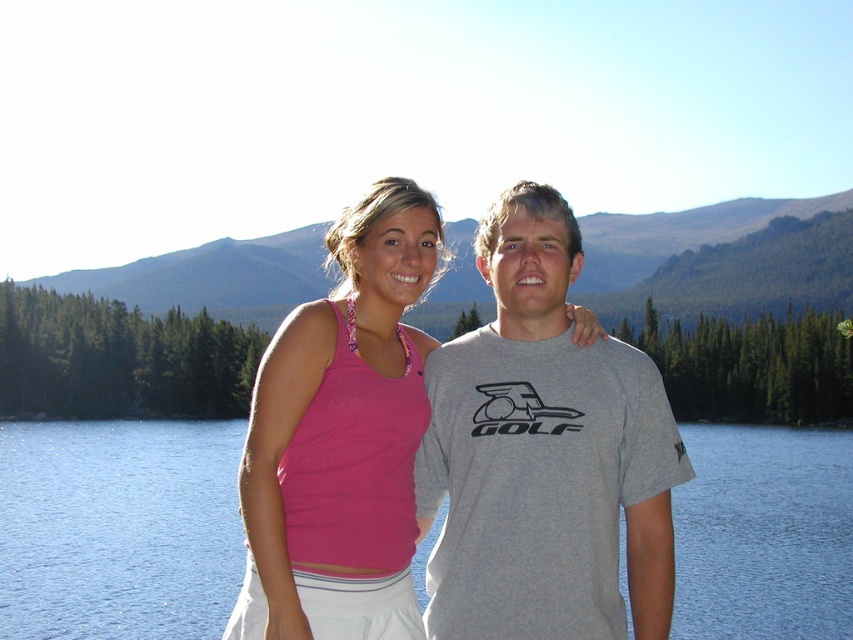
You are planning to take a photo of the blue water at center and the green forested mountain at upper center. Which object should you focus on first if you want to capture both in one shot without moving the camera?

You should focus on the green forested mountain at upper center first because it is above the blue water at center, so adjusting the focus starting from the mountain ensures both are in frame.